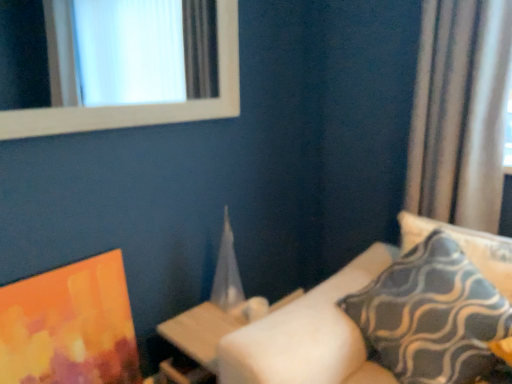
Measure the distance between point (501, 142) and camera.

They are 5.58 feet apart.

Measure the distance between wooden table at center and camera.

4.33 feet.

Identify the location of silky beige curtain at right. The image size is (512, 384). (460, 112).

Considering the relative positions of matte orange painting at lower left and white wooden frame at upper left in the image provided, is matte orange painting at lower left in front of white wooden frame at upper left?

No, matte orange painting at lower left is further to the viewer.

Looking at this image, which object is positioned more to the left, matte orange painting at lower left or white wooden frame at upper left?

Positioned to the left is matte orange painting at lower left.

From a real-world perspective, is matte orange painting at lower left physically located above or below white wooden frame at upper left?

In terms of real-world spatial position, matte orange painting at lower left is below white wooden frame at upper left.

From the image's perspective, which is below, blue-patterned fabric pillow at right, arranged as the first pillow when viewed from the right, or patterned fabric pillow at right, which is counted as the 2th pillow, starting from the right?

patterned fabric pillow at right, which is counted as the 2th pillow, starting from the right, appears lower in the image.

From a real-world perspective, which is physically below, blue-patterned fabric pillow at right, positioned as the second pillow in left-to-right order, or patterned fabric pillow at right, which ranks as the 1th pillow in left-to-right order?

In real-world perspective, patterned fabric pillow at right, which ranks as the 1th pillow in left-to-right order, is lower.

Which is more to the left, blue-patterned fabric pillow at right, positioned as the second pillow in left-to-right order, or patterned fabric pillow at right, which is counted as the 2th pillow, starting from the right?

patterned fabric pillow at right, which is counted as the 2th pillow, starting from the right, is more to the left.

Is blue-patterned fabric pillow at right, arranged as the first pillow when viewed from the right, in contact with silky beige curtain at right?

There is a gap between blue-patterned fabric pillow at right, arranged as the first pillow when viewed from the right, and silky beige curtain at right.

Which object is positioned more to the left, blue-patterned fabric pillow at right, positioned as the second pillow in left-to-right order, or silky beige curtain at right?

blue-patterned fabric pillow at right, positioned as the second pillow in left-to-right order, is more to the left.

Is blue-patterned fabric pillow at right, positioned as the second pillow in left-to-right order, facing towards silky beige curtain at right?

No, blue-patterned fabric pillow at right, positioned as the second pillow in left-to-right order, does not turn towards silky beige curtain at right.

Can you tell me how much blue-patterned fabric pillow at right, positioned as the second pillow in left-to-right order, and silky beige curtain at right differ in facing direction?

0.507 degrees separate the facing orientations of blue-patterned fabric pillow at right, positioned as the second pillow in left-to-right order, and silky beige curtain at right.

Image resolution: width=512 pixels, height=384 pixels. I want to click on table below the silky beige curtain at right (from the image's perspective), so click(196, 341).

Can you tell me how much silky beige curtain at right and wooden table at center differ in facing direction?

0.456 degrees.

Which of these two, silky beige curtain at right or wooden table at center, is wider?

wooden table at center.

From a real-world perspective, which object rests below the other?

wooden table at center, from a real-world perspective.

In the image, there is a patterned fabric pillow at right, which is counted as the 2th pillow, starting from the right. In order to click on table below it (from a real-world perspective) in this screenshot , I will do `click(196, 341)`.

Between wooden table at center and patterned fabric pillow at right, which ranks as the 1th pillow in left-to-right order, which one appears on the right side from the viewer's perspective?

Positioned to the right is patterned fabric pillow at right, which ranks as the 1th pillow in left-to-right order.

From the image's perspective, which is below, wooden table at center or patterned fabric pillow at right, which ranks as the 1th pillow in left-to-right order?

wooden table at center, from the image's perspective.

Does wooden table at center touch blue-patterned fabric pillow at right, arranged as the first pillow when viewed from the right?

No.

Is wooden table at center oriented away from blue-patterned fabric pillow at right, positioned as the second pillow in left-to-right order?

wooden table at center does not have its back to blue-patterned fabric pillow at right, positioned as the second pillow in left-to-right order.

Between wooden table at center and blue-patterned fabric pillow at right, arranged as the first pillow when viewed from the right, which one appears on the left side from the viewer's perspective?

Positioned to the left is wooden table at center.

Considering the sizes of objects wooden table at center and blue-patterned fabric pillow at right, positioned as the second pillow in left-to-right order, in the image provided, who is smaller, wooden table at center or blue-patterned fabric pillow at right, positioned as the second pillow in left-to-right order,?

blue-patterned fabric pillow at right, positioned as the second pillow in left-to-right order.

Does white wooden frame at upper left turn towards patterned fabric pillow at right, which ranks as the 1th pillow in left-to-right order?

No.

Would you say white wooden frame at upper left is outside patterned fabric pillow at right, which is counted as the 2th pillow, starting from the right?

Indeed, white wooden frame at upper left is completely outside patterned fabric pillow at right, which is counted as the 2th pillow, starting from the right.

Can you confirm if white wooden frame at upper left is thinner than patterned fabric pillow at right, which is counted as the 2th pillow, starting from the right?

Yes.

The image size is (512, 384). What are the coordinates of `window above the matte orange painting at lower left (from the image's perspective)` in the screenshot? It's located at 141,105.

Where is `pillow lying in front of the blue-patterned fabric pillow at right, positioned as the second pillow in left-to-right order`? This screenshot has width=512, height=384. pillow lying in front of the blue-patterned fabric pillow at right, positioned as the second pillow in left-to-right order is located at coordinates (431, 315).

Which object lies nearer to the anchor point blue-patterned fabric pillow at right, positioned as the second pillow in left-to-right order, wooden table at center or matte orange painting at lower left?

Among the two, wooden table at center is located nearer to blue-patterned fabric pillow at right, positioned as the second pillow in left-to-right order.

Based on their spatial positions, is patterned fabric pillow at right, which ranks as the 1th pillow in left-to-right order, or matte orange painting at lower left closer to blue-patterned fabric pillow at right, arranged as the first pillow when viewed from the right?

patterned fabric pillow at right, which ranks as the 1th pillow in left-to-right order, is positioned closer to the anchor blue-patterned fabric pillow at right, arranged as the first pillow when viewed from the right.

Considering their positions, is wooden table at center positioned further to patterned fabric pillow at right, which is counted as the 2th pillow, starting from the right, than matte orange painting at lower left?

The object further to patterned fabric pillow at right, which is counted as the 2th pillow, starting from the right, is matte orange painting at lower left.

Considering their positions, is wooden table at center positioned further to patterned fabric pillow at right, which ranks as the 1th pillow in left-to-right order, than blue-patterned fabric pillow at right, arranged as the first pillow when viewed from the right?

Among the two, wooden table at center is located further to patterned fabric pillow at right, which ranks as the 1th pillow in left-to-right order.

Looking at the image, which one is located further to patterned fabric pillow at right, which is counted as the 2th pillow, starting from the right, white wooden frame at upper left or silky beige curtain at right?

white wooden frame at upper left is further to patterned fabric pillow at right, which is counted as the 2th pillow, starting from the right.

From the image, which object appears to be farther from wooden table at center, blue-patterned fabric pillow at right, arranged as the first pillow when viewed from the right, or matte orange painting at lower left?

blue-patterned fabric pillow at right, arranged as the first pillow when viewed from the right, lies further to wooden table at center than the other object.

From the image, which object appears to be nearer to wooden table at center, white wooden frame at upper left or matte orange painting at lower left?

matte orange painting at lower left is positioned closer to the anchor wooden table at center.

Looking at the image, which one is located closer to white wooden frame at upper left, silky beige curtain at right or matte orange painting at lower left?

matte orange painting at lower left is positioned closer to the anchor white wooden frame at upper left.

The image size is (512, 384). I want to click on window between matte orange painting at lower left and blue-patterned fabric pillow at right, positioned as the second pillow in left-to-right order, so click(x=141, y=105).

The height and width of the screenshot is (384, 512). I want to click on window situated between matte orange painting at lower left and silky beige curtain at right from left to right, so click(x=141, y=105).

Identify the location of picture frame that lies between white wooden frame at upper left and wooden table at center from top to bottom. (69, 326).

The width and height of the screenshot is (512, 384). What are the coordinates of `pillow located between wooden table at center and blue-patterned fabric pillow at right, arranged as the first pillow when viewed from the right, in the left-right direction` in the screenshot? It's located at (431, 315).